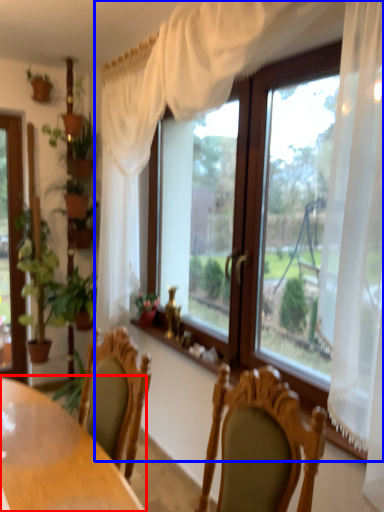
Question: Which object is closer to the camera taking this photo, table (highlighted by a red box) or window (highlighted by a blue box)?

Choices:
 (A) table
 (B) window

Answer: (B)